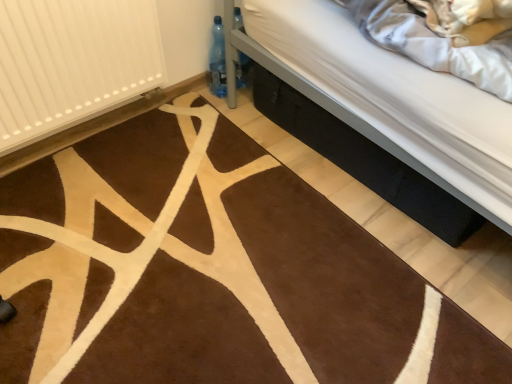
Question: Is black fabric bed at lower right not inside white ribbed radiator at left?

Choices:
 (A) yes
 (B) no

Answer: (A)

Question: Is black fabric bed at lower right to the left of white ribbed radiator at left from the viewer's perspective?

Choices:
 (A) no
 (B) yes

Answer: (A)

Question: Could you tell me if black fabric bed at lower right is turned towards white ribbed radiator at left?

Choices:
 (A) yes
 (B) no

Answer: (B)

Question: Is black fabric bed at lower right directly adjacent to white ribbed radiator at left?

Choices:
 (A) no
 (B) yes

Answer: (A)

Question: Would you say black fabric bed at lower right contains white ribbed radiator at left?

Choices:
 (A) yes
 (B) no

Answer: (B)

Question: Is black fabric bed at lower right positioned in front of white ribbed radiator at left?

Choices:
 (A) yes
 (B) no

Answer: (B)

Question: Is black fabric bed at lower right located within white ribbed radiator at left?

Choices:
 (A) no
 (B) yes

Answer: (A)

Question: From the image's perspective, would you say white ribbed radiator at left is positioned over black fabric bed at lower right?

Choices:
 (A) yes
 (B) no

Answer: (A)

Question: Considering the relative positions of white ribbed radiator at left and black fabric bed at lower right in the image provided, is white ribbed radiator at left in front of black fabric bed at lower right?

Choices:
 (A) no
 (B) yes

Answer: (B)

Question: Does white ribbed radiator at left have a smaller size compared to black fabric bed at lower right?

Choices:
 (A) no
 (B) yes

Answer: (B)

Question: Is white ribbed radiator at left positioned behind black fabric bed at lower right?

Choices:
 (A) yes
 (B) no

Answer: (B)

Question: Considering the relative positions of white ribbed radiator at left and black fabric bed at lower right in the image provided, is white ribbed radiator at left to the right of black fabric bed at lower right from the viewer's perspective?

Choices:
 (A) yes
 (B) no

Answer: (B)

Question: Would you say black fabric bed at lower right is to the left or to the right of white ribbed radiator at left in the picture?

Choices:
 (A) left
 (B) right

Answer: (B)